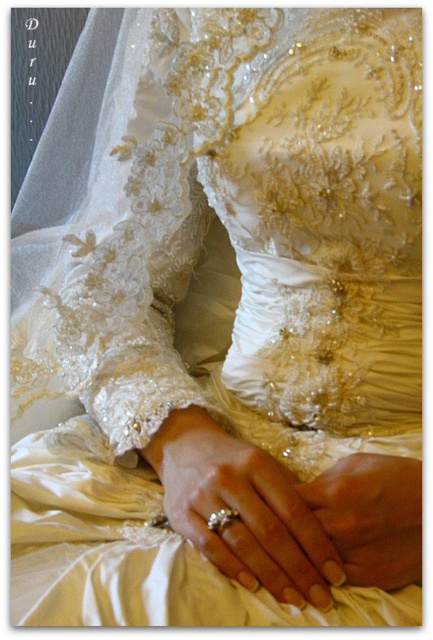
Between smooth beige hand at center and gold shiny ring at center, which one has more height?

smooth beige hand at center

Between smooth beige hand at center and gold shiny ring at center, which one appears on the right side from the viewer's perspective?

From the viewer's perspective, smooth beige hand at center appears more on the right side.

Does point (365, 568) lie in front of point (215, 524)?

Yes, it is.

The image size is (433, 640). Find the location of `smooth beige hand at center`. smooth beige hand at center is located at coordinates (371, 516).

Does silver metallic ring at center have a smaller size compared to gold shiny ring at center?

Incorrect, silver metallic ring at center is not smaller in size than gold shiny ring at center.

Is point (203, 484) positioned in front of point (207, 518)?

No, it is behind (207, 518).

You are a GUI agent. You are given a task and a screenshot of the screen. Output one action in this format:
    pyautogui.click(x=<x>, y=<y>)
    Task: Click on the silver metallic ring at center
    The width and height of the screenshot is (433, 640).
    Given the screenshot: What is the action you would take?
    pyautogui.click(x=242, y=509)

Consider the image. Does silver metallic ring at center have a larger size compared to smooth beige hand at center?

Yes, silver metallic ring at center is bigger than smooth beige hand at center.

Is point (145, 452) closer to camera compared to point (361, 476)?

No, it is not.

Where is `silver metallic ring at center`? The image size is (433, 640). silver metallic ring at center is located at coordinates (242, 509).